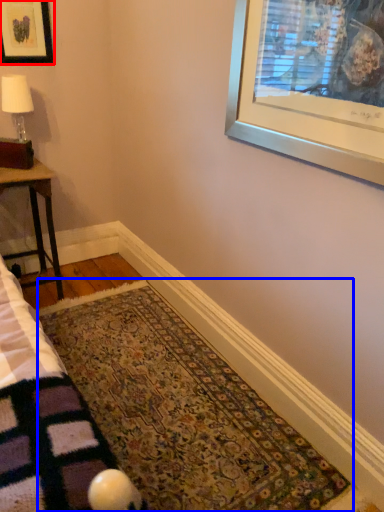
Question: Which object is further to the camera taking this photo, picture frame (highlighted by a red box) or mat (highlighted by a blue box)?

Choices:
 (A) picture frame
 (B) mat

Answer: (A)